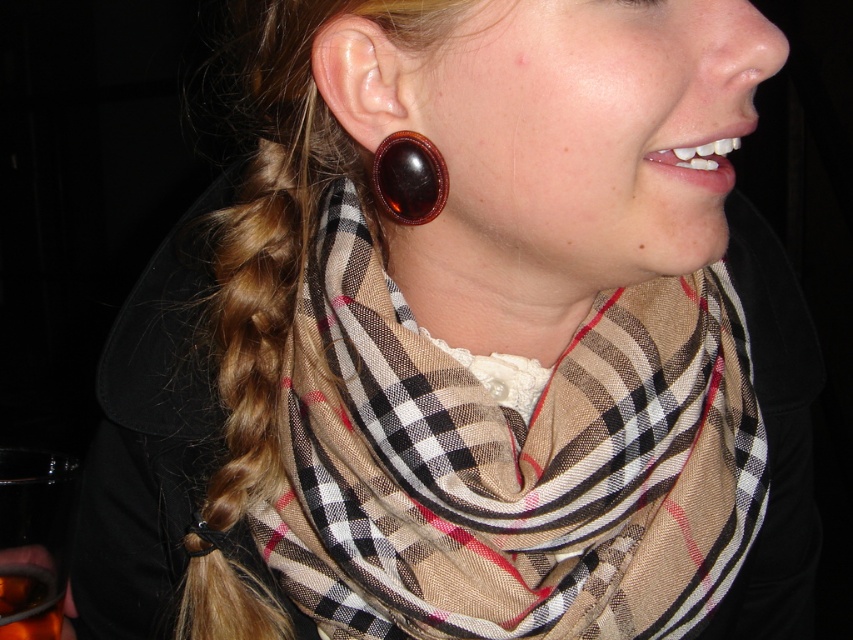
Question: In this image, where is plaid fabric scarf at center located relative to translucent amber liquid at lower left?

Choices:
 (A) right
 (B) left

Answer: (A)

Question: Considering the relative positions of plaid fabric scarf at center and translucent amber liquid at lower left in the image provided, where is plaid fabric scarf at center located with respect to translucent amber liquid at lower left?

Choices:
 (A) left
 (B) right

Answer: (B)

Question: Among these points, which one is nearest to the camera?

Choices:
 (A) (3, 608)
 (B) (393, 193)
 (C) (474, 611)

Answer: (B)

Question: Which object is positioned closest to the shiny brown earring at ear?

Choices:
 (A) translucent amber liquid at lower left
 (B) plaid fabric scarf at center

Answer: (B)

Question: Where is shiny brown earring at ear located in relation to translucent amber liquid at lower left in the image?

Choices:
 (A) above
 (B) below

Answer: (A)

Question: Among these objects, which one is nearest to the camera?

Choices:
 (A) shiny brown earring at ear
 (B) translucent amber liquid at lower left

Answer: (A)